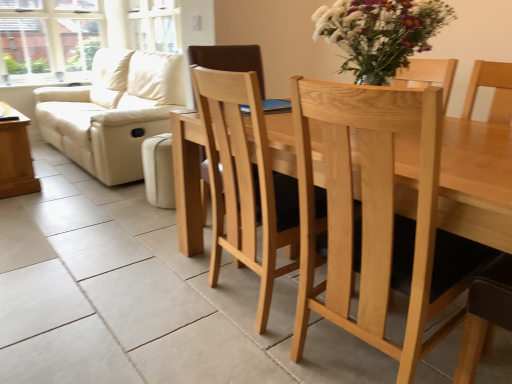
Question: From the image's perspective, is clear glass window at upper left positioned above or below natural wood chair at center?

Choices:
 (A) above
 (B) below

Answer: (A)

Question: Is clear glass window at upper left bigger or smaller than natural wood chair at center?

Choices:
 (A) small
 (B) big

Answer: (A)

Question: Based on their relative distances, which object is nearer to the clear glass window at upper left?

Choices:
 (A) beige leather couch at left
 (B) natural wood chair at center
 (C) wooden side table at left

Answer: (A)

Question: Estimate the real-world distances between objects in this image. Which object is closer to the natural wood chair at center?

Choices:
 (A) clear glass window at upper left
 (B) wooden side table at left
 (C) beige leather couch at left

Answer: (C)